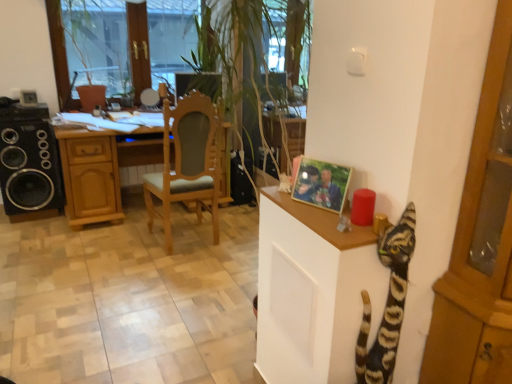
Question: Is striped fur cat at right in front of light brown wood chair at center?

Choices:
 (A) no
 (B) yes

Answer: (B)

Question: From the image's perspective, is striped fur cat at right over light brown wood chair at center?

Choices:
 (A) no
 (B) yes

Answer: (A)

Question: Is striped fur cat at right not near light brown wood chair at center?

Choices:
 (A) no
 (B) yes

Answer: (B)

Question: Is striped fur cat at right bigger than light brown wood chair at center?

Choices:
 (A) no
 (B) yes

Answer: (A)

Question: Does striped fur cat at right come behind light brown wood chair at center?

Choices:
 (A) no
 (B) yes

Answer: (A)

Question: Is black matte speaker at left bigger or smaller than transparent glass window screen at upper left?

Choices:
 (A) small
 (B) big

Answer: (B)

Question: Based on their positions, is black matte speaker at left located to the left or right of transparent glass window screen at upper left?

Choices:
 (A) right
 (B) left

Answer: (B)

Question: From the image's perspective, relative to transparent glass window screen at upper left, is black matte speaker at left above or below?

Choices:
 (A) above
 (B) below

Answer: (B)

Question: In terms of width, does black matte speaker at left look wider or thinner when compared to transparent glass window screen at upper left?

Choices:
 (A) wide
 (B) thin

Answer: (A)

Question: Is point (505, 36) closer or farther from the camera than point (51, 140)?

Choices:
 (A) farther
 (B) closer

Answer: (B)

Question: Is wooden cabinet at right inside or outside of black matte speaker at left?

Choices:
 (A) inside
 (B) outside

Answer: (B)

Question: Considering the positions of wooden cabinet at right and black matte speaker at left in the image, is wooden cabinet at right wider or thinner than black matte speaker at left?

Choices:
 (A) wide
 (B) thin

Answer: (B)

Question: From a real-world perspective, is wooden cabinet at right physically located above or below black matte speaker at left?

Choices:
 (A) below
 (B) above

Answer: (B)

Question: Is wooden desk at center inside or outside of light brown wood chair at center?

Choices:
 (A) inside
 (B) outside

Answer: (B)

Question: In terms of height, does wooden desk at center look taller or shorter compared to light brown wood chair at center?

Choices:
 (A) tall
 (B) short

Answer: (B)